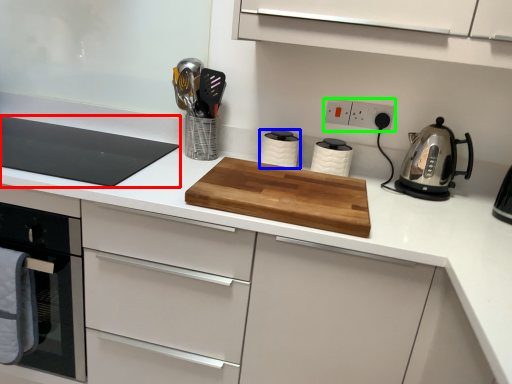
Question: Which is farther away from gas stove (highlighted by a red box)? kitchen appliance (highlighted by a blue box) or electric outlet (highlighted by a green box)?

Choices:
 (A) kitchen appliance
 (B) electric outlet

Answer: (B)